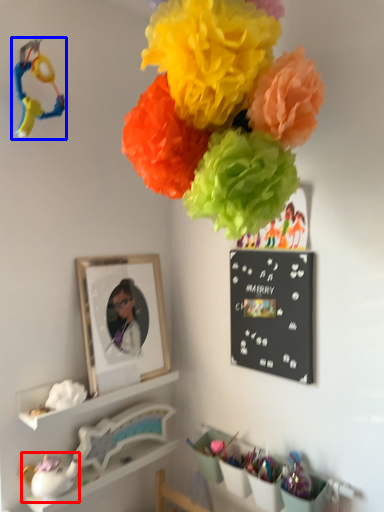
Question: Which of the following is the farthest to the observer, toy (highlighted by a red box) or toy (highlighted by a blue box)?

Choices:
 (A) toy
 (B) toy

Answer: (A)